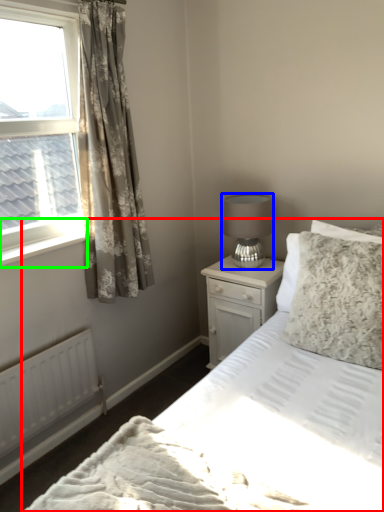
Question: Which object is the farthest from bed (highlighted by a red box)? Choose among these: table lamp (highlighted by a blue box) or window sill (highlighted by a green box).

Choices:
 (A) table lamp
 (B) window sill

Answer: (B)